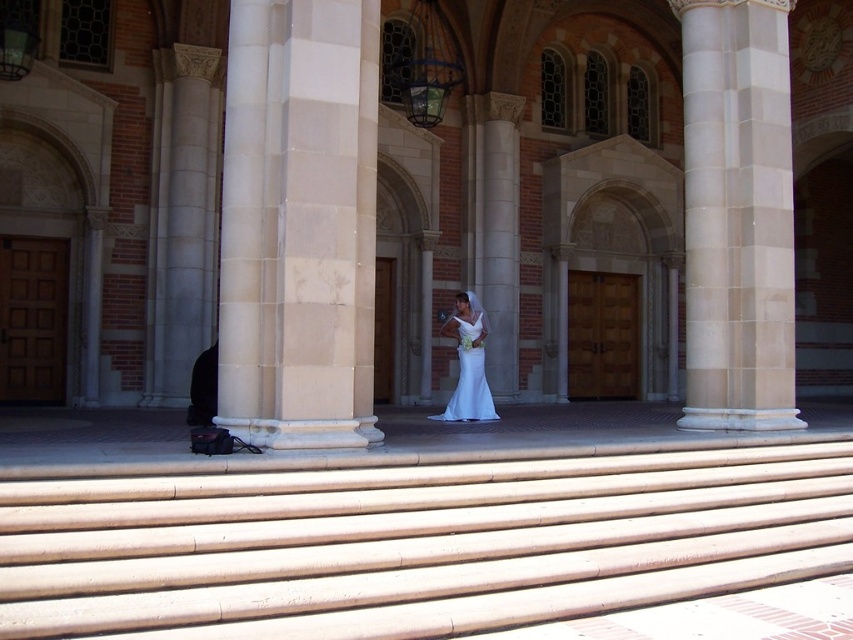
Question: Can you confirm if white satin dress at center is positioned above black leather jacket at lower left?

Choices:
 (A) yes
 (B) no

Answer: (A)

Question: Which object is positioned closest to the white satin dress at center?

Choices:
 (A) black leather jacket at lower left
 (B) white marble pillar at center
 (C) beige marble column at center
 (D) smooth concrete stairs at center

Answer: (A)

Question: Which of these objects is positioned closest to the beige marble column at center?

Choices:
 (A) black leather jacket at lower left
 (B) white satin dress at center
 (C) white marble pillar at center

Answer: (B)

Question: Which object is closer to the camera taking this photo?

Choices:
 (A) beige marble column at center
 (B) black leather jacket at lower left
 (C) white satin dress at center
 (D) white marble pillar at center

Answer: (D)

Question: Does white marble pillar at center appear on the left side of white satin dress at center?

Choices:
 (A) yes
 (B) no

Answer: (A)

Question: Is smooth concrete stairs at center closer to the viewer compared to white satin dress at center?

Choices:
 (A) no
 (B) yes

Answer: (B)